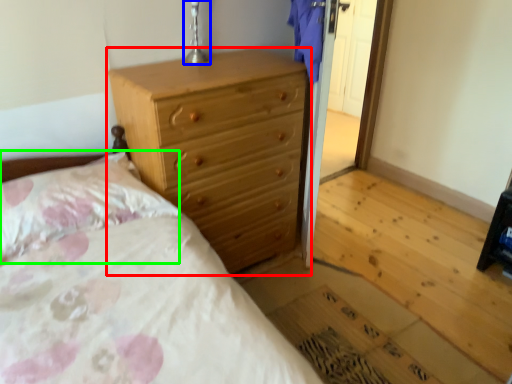
Question: Which object is the farthest from chest of drawers (highlighted by a red box)? Choose among these: table lamp (highlighted by a blue box) or pillow (highlighted by a green box).

Choices:
 (A) table lamp
 (B) pillow

Answer: (A)